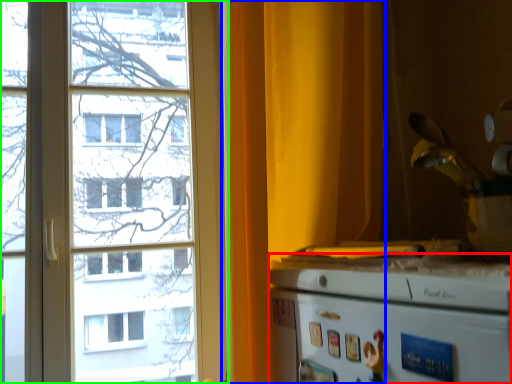
Question: Estimate the real-world distances between objects in this image. Which object is farther from appliance (highlighted by a red box), curtain (highlighted by a blue box) or window (highlighted by a green box)?

Choices:
 (A) curtain
 (B) window

Answer: (B)